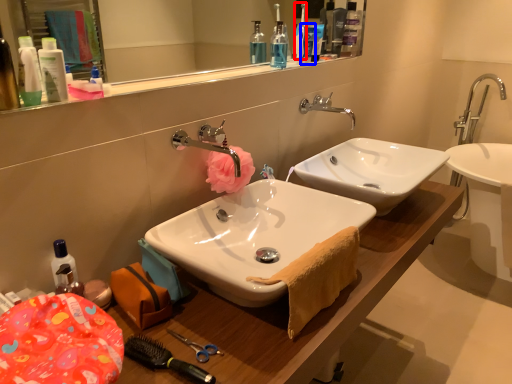
Question: Which object appears farthest to the camera in this image, toothbrush (highlighted by a red box) or toiletry (highlighted by a blue box)?

Choices:
 (A) toothbrush
 (B) toiletry

Answer: (B)